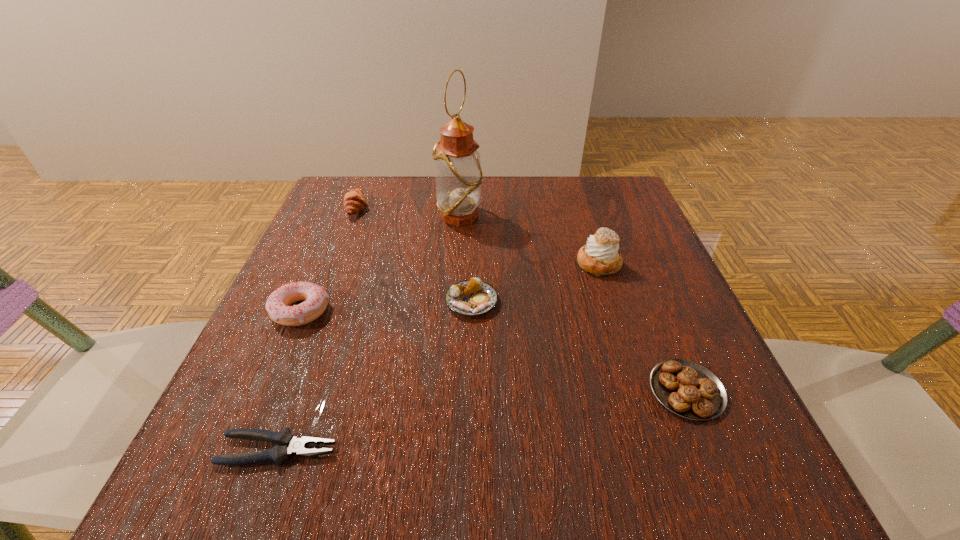
Locate an element on the screen. vacant area at the near left corner of the desktop is located at coordinates (212, 504).

The width and height of the screenshot is (960, 540). What are the coordinates of `vacant space at the far right corner of the desktop` in the screenshot? It's located at (579, 213).

You are a GUI agent. You are given a task and a screenshot of the screen. Output one action in this format:
    pyautogui.click(x=<x>, y=<y>)
    Task: Click on the vacant space at the near right corner
    This screenshot has width=960, height=540.
    Given the screenshot: What is the action you would take?
    pyautogui.click(x=759, y=470)

Locate an element on the screen. The image size is (960, 540). vacant space that's between the doughnut and the second nearest pastry is located at coordinates (386, 307).

Find the location of a particular element. This screenshot has width=960, height=540. vacant region between the shortest object and the oil lamp is located at coordinates (369, 333).

Where is `free space between the second tallest object and the tallest object`? The width and height of the screenshot is (960, 540). free space between the second tallest object and the tallest object is located at coordinates (529, 240).

The height and width of the screenshot is (540, 960). What are the coordinates of `empty space that is in between the doughnut and the tallest pastry` in the screenshot? It's located at (449, 288).

Identify the location of free space between the third farthest object and the farthest pastry. (478, 236).

Identify the location of free area in between the farthest pastry and the shortest object. (318, 329).

Where is `vacant space that's between the third pastry from right to left and the tallest object`? The image size is (960, 540). vacant space that's between the third pastry from right to left and the tallest object is located at coordinates (466, 259).